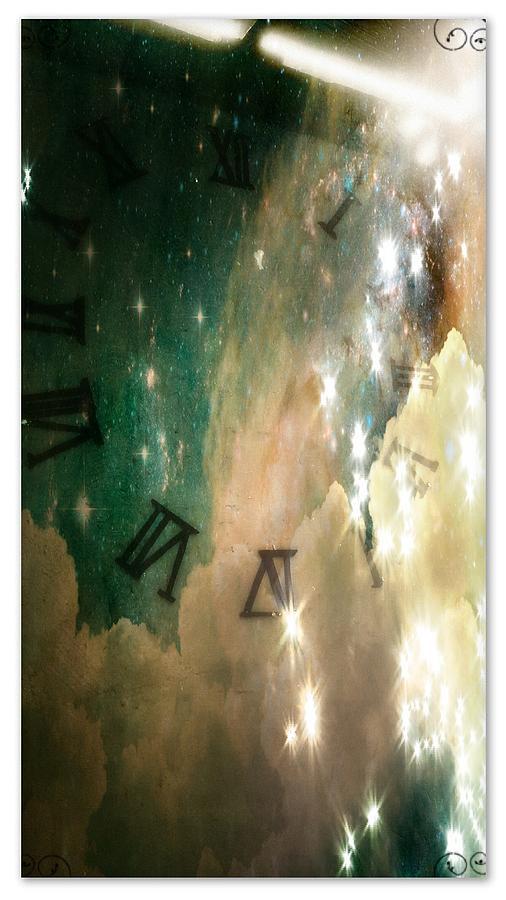
Locate an element on the screen. The image size is (506, 900). clock is located at coordinates (305, 112).